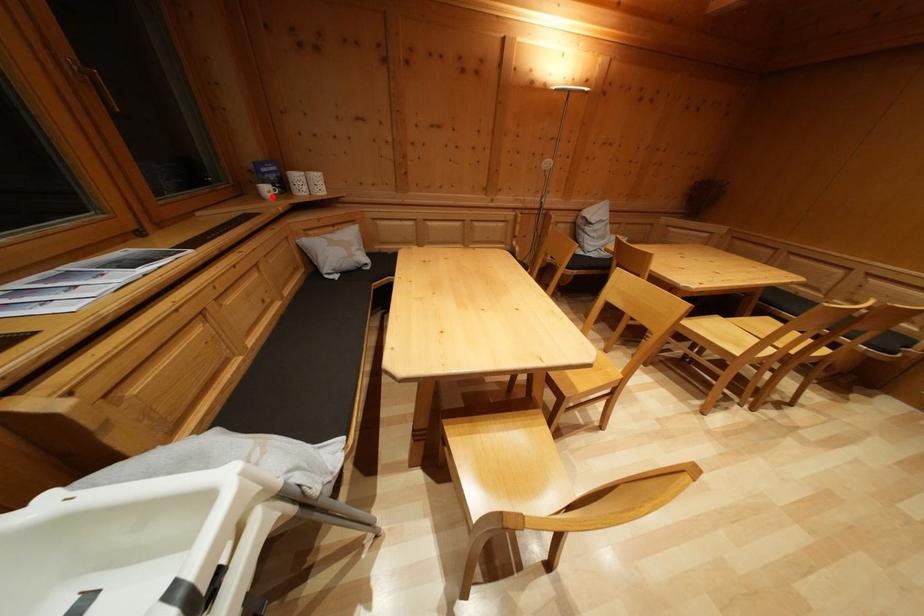
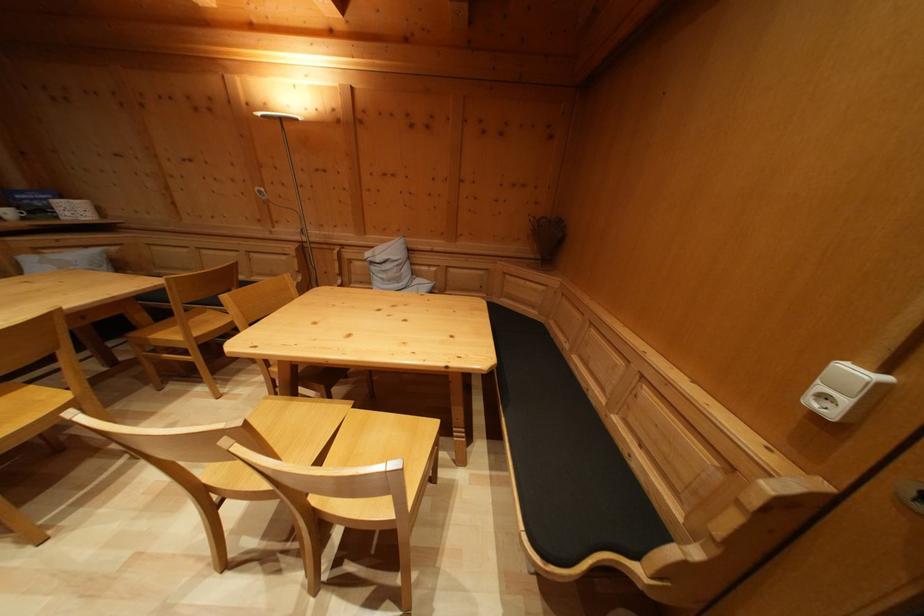
Where in the second image is the point corresponding to the highlighted location from the first image?

(14, 219)